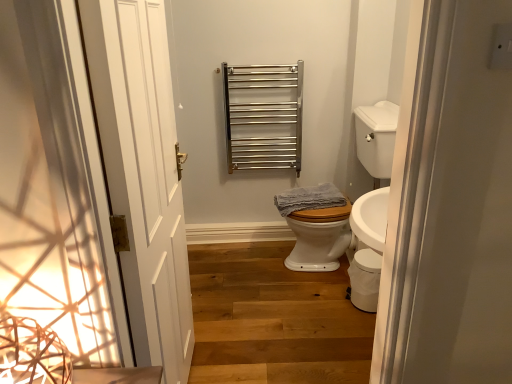
Question: From a real-world perspective, relative to white glossy toilet bowl at lower right, is wooden stairs at center vertically above or below?

Choices:
 (A) above
 (B) below

Answer: (B)

Question: In terms of height, does wooden stairs at center look taller or shorter compared to white glossy toilet bowl at lower right?

Choices:
 (A) tall
 (B) short

Answer: (B)

Question: Which of these objects is positioned closest to the white glossy sink at right?

Choices:
 (A) white glossy toilet bowl at lower right
 (B) wooden stairs at center
 (C) blue textured towel at center
 (D) white wooden door at left
 (E) polished stainless steel towel rack at upper center

Answer: (C)

Question: Which object is positioned farthest from the polished stainless steel towel rack at upper center?

Choices:
 (A) white wooden door at left
 (B) wooden stairs at center
 (C) blue textured towel at center
 (D) white glossy sink at right
 (E) white glossy toilet bowl at lower right

Answer: (A)